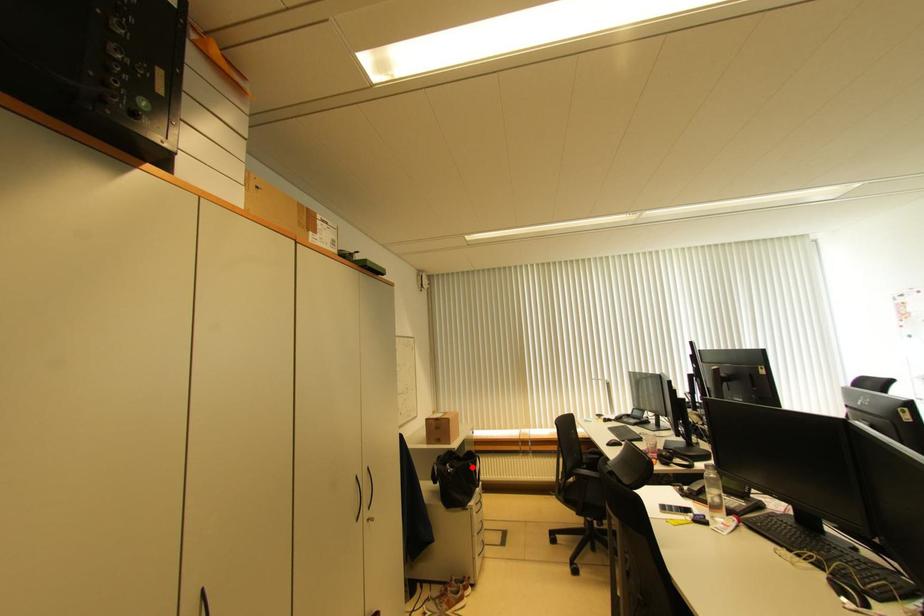
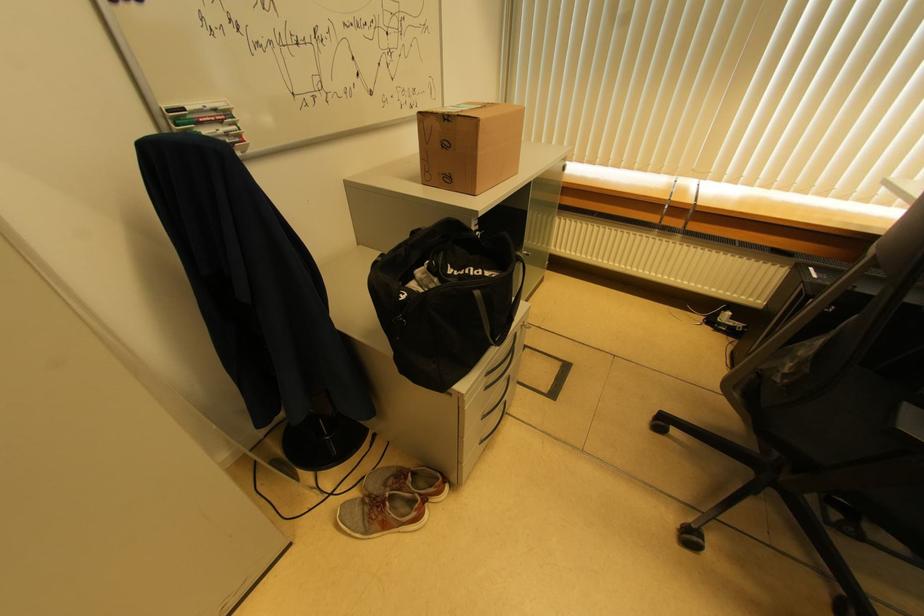
The point at the highlighted location is marked in the first image. Where is the corresponding point in the second image?

(479, 296)